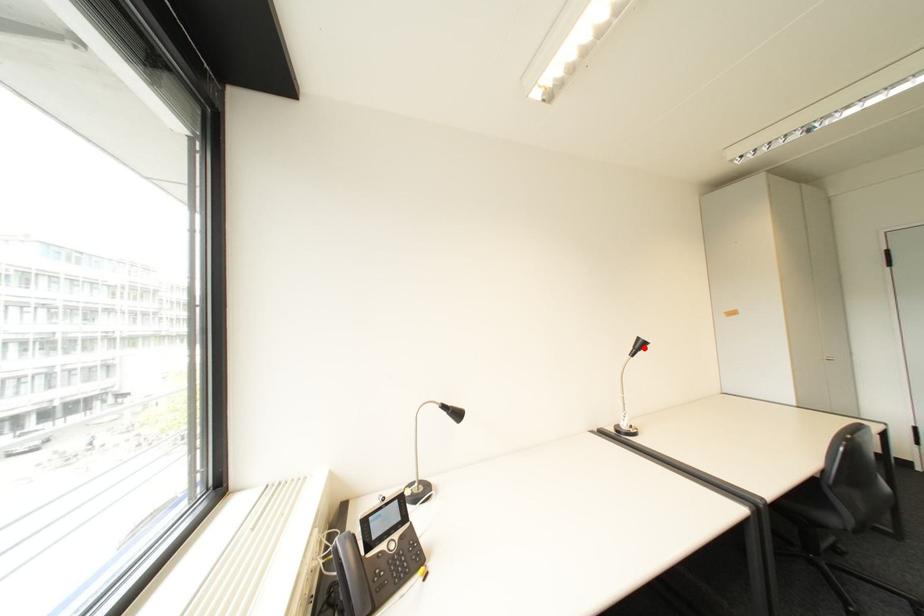
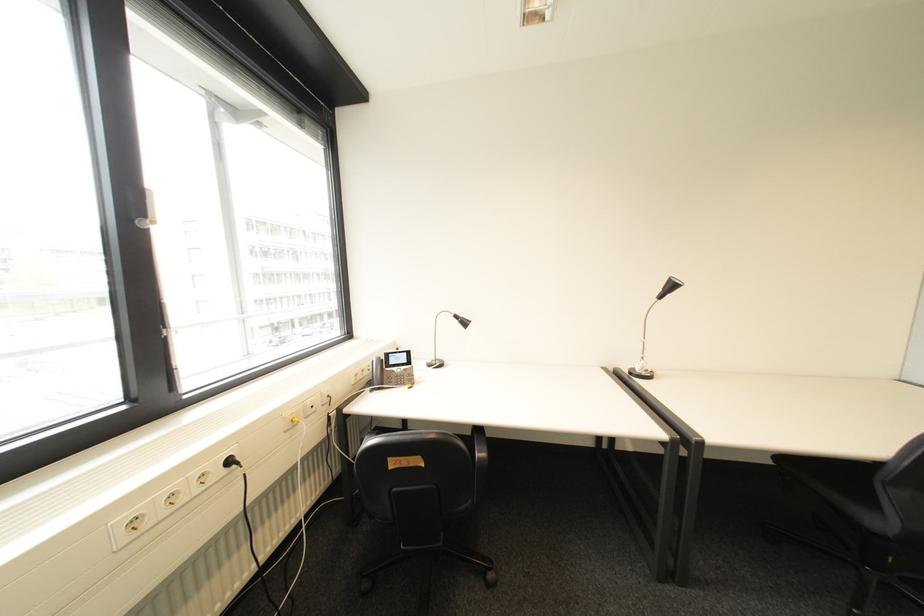
Question: I am providing you with two images of the same scene from different viewpoints. A red point is marked on the first image. Is the red point's position out of view in image 2?

Choices:
 (A) Yes
 (B) No

Answer: (B)